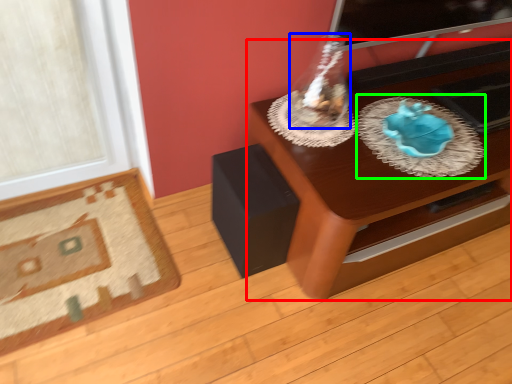
Question: Which is nearer to the table (highlighted by a red box)? glass vase (highlighted by a blue box) or glass plate (highlighted by a green box).

Choices:
 (A) glass vase
 (B) glass plate

Answer: (B)